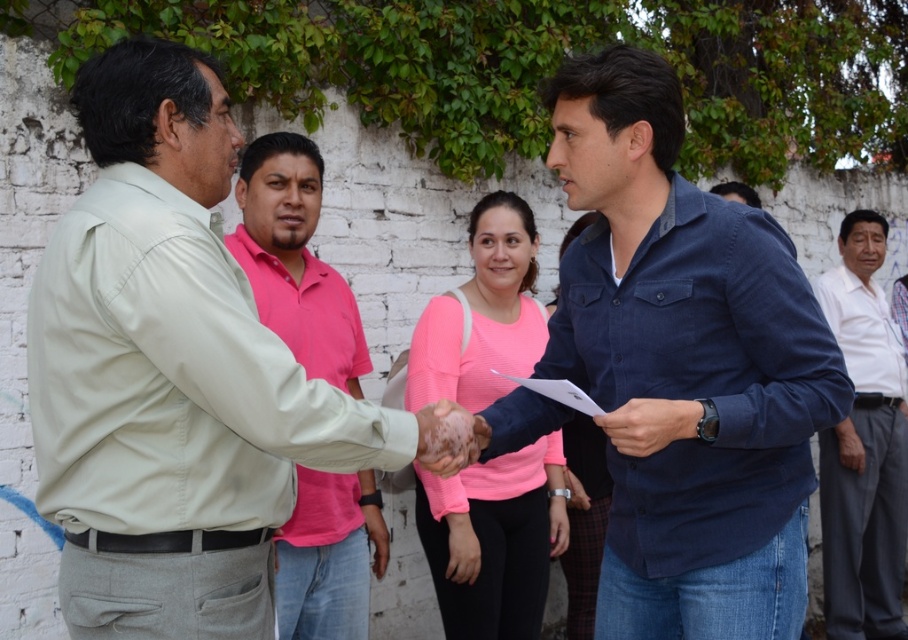
From the picture: Does light beige shirt at center have a lesser height compared to pink matte shirt at center?

Yes.

Between light beige shirt at center and pink matte shirt at center, which one has less height?

light beige shirt at center is shorter.

I want to click on light beige shirt at center, so click(x=174, y=374).

Which is below, blue denim shirt at center or pink cotton shirt at center?

blue denim shirt at center

Can you confirm if blue denim shirt at center is smaller than pink cotton shirt at center?

Incorrect, blue denim shirt at center is not smaller in size than pink cotton shirt at center.

Between point (703, 557) and point (292, 628), which one is positioned behind?

Positioned behind is point (292, 628).

Find the location of a particular element. Image resolution: width=908 pixels, height=640 pixels. blue denim shirt at center is located at coordinates (686, 365).

Is point (289, 369) positioned after point (861, 356)?

No.

Who is more distant from viewer, (227, 141) or (869, 483)?

Point (869, 483)

In order to click on light beige shirt at center in this screenshot , I will do `click(174, 374)`.